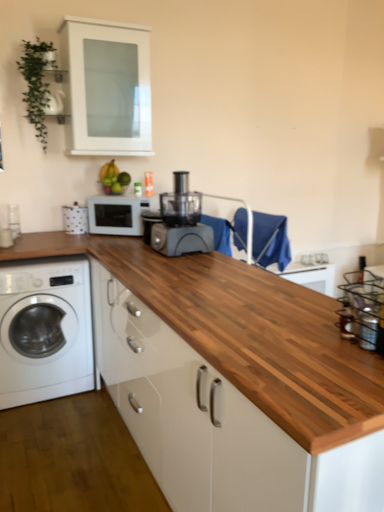
Identify the location of free space to the back side of clear glass bottle at right. (312, 318).